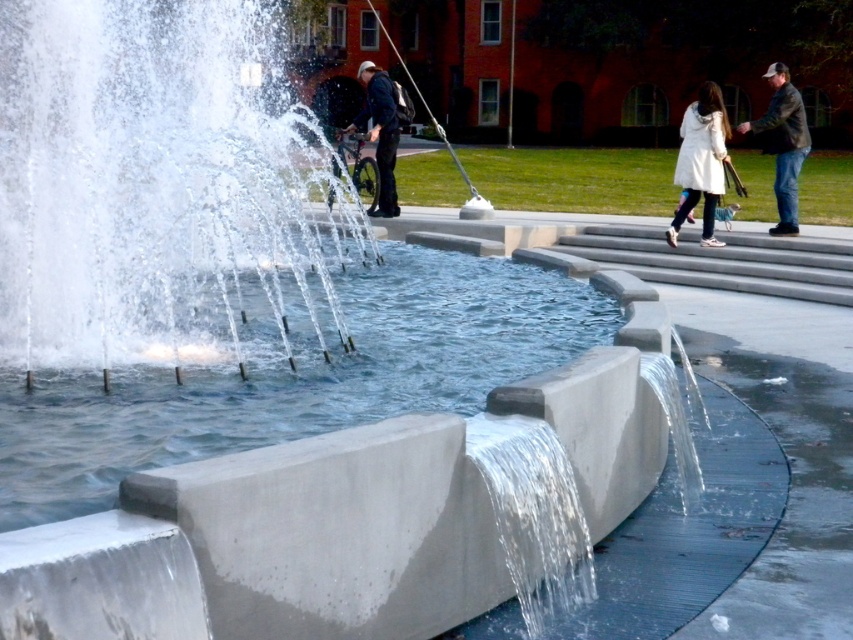
Does clear concrete water at center appear on the left side of dark brown leather jacket at upper right?

Indeed, clear concrete water at center is positioned on the left side of dark brown leather jacket at upper right.

Between point (404, 244) and point (787, 144), which one is positioned behind?

Positioned behind is point (787, 144).

Identify the location of clear concrete water at center. This screenshot has width=853, height=640. (294, 378).

Looking at this image, can you confirm if clear concrete water at center is positioned above dark blue jeans at center?

Actually, clear concrete water at center is below dark blue jeans at center.

Can you confirm if clear concrete water at center is thinner than dark blue jeans at center?

Yes.

Identify the location of clear concrete water at center. This screenshot has width=853, height=640. (294, 378).

The image size is (853, 640). I want to click on clear concrete water at center, so click(294, 378).

Is clear concrete water at center shorter than white matte coat at upper right?

Yes.

Is point (456, 321) closer to camera compared to point (704, 112)?

Yes, point (456, 321) is closer to viewer.

Does point (294, 429) come closer to viewer compared to point (724, 147)?

Yes, point (294, 429) is in front of point (724, 147).

In order to click on clear concrete water at center in this screenshot , I will do `click(294, 378)`.